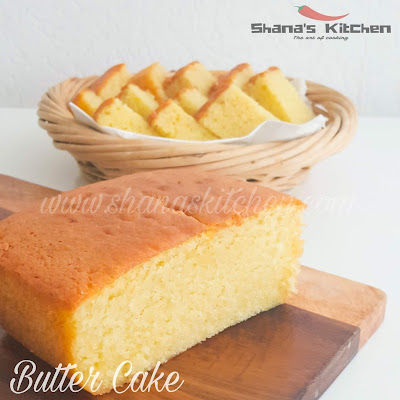
Locate an element on the screen. The image size is (400, 400). white flat surface is located at coordinates (332, 240).